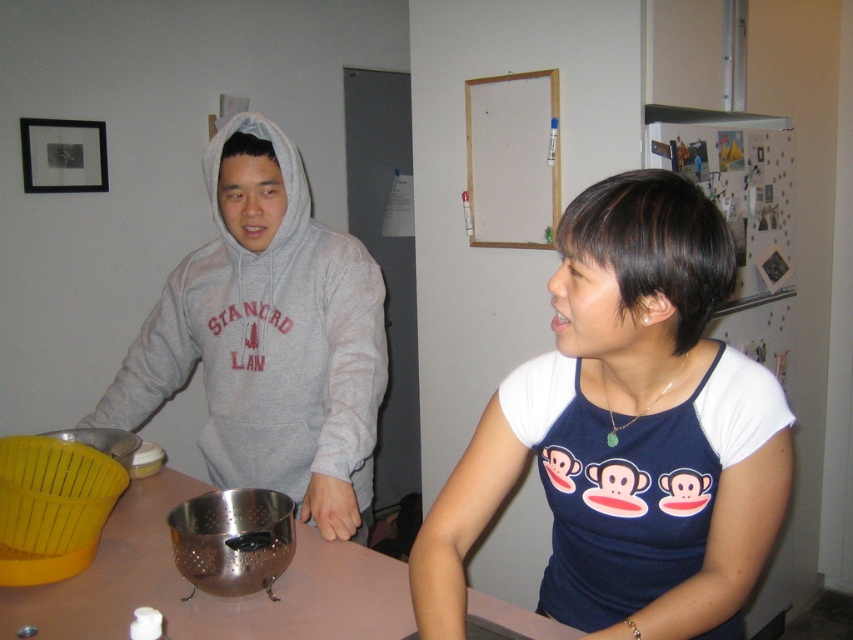
You are trying to decide if the blue fabric shirt at center can be placed inside the metallic silver colander at center. Based on their sizes, what do you think?

The blue fabric shirt at center has a smaller width than the metallic silver colander at center, so it can fit inside.

You are standing in the kitchen and need to pass between the gray hoodie at left and the blue fabric shirt at center to reach the refrigerator. Which direction should you move to avoid bumping into either?

Since the gray hoodie at left is closer to you than the blue fabric shirt at center, you should move around the gray hoodie at left to avoid bumping into either.